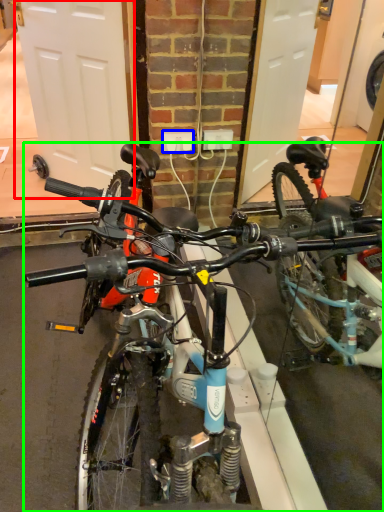
Question: Which object is the farthest from garage door (highlighted by a red box)? Choose among these: power outlet (highlighted by a blue box) or bicycle (highlighted by a green box).

Choices:
 (A) power outlet
 (B) bicycle

Answer: (B)